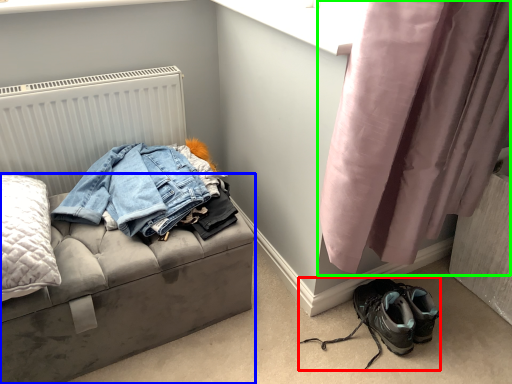
Question: Considering the real-world distances, which object is farthest from footwear (highlighted by a red box)? furniture (highlighted by a blue box) or curtain (highlighted by a green box)?

Choices:
 (A) furniture
 (B) curtain

Answer: (A)